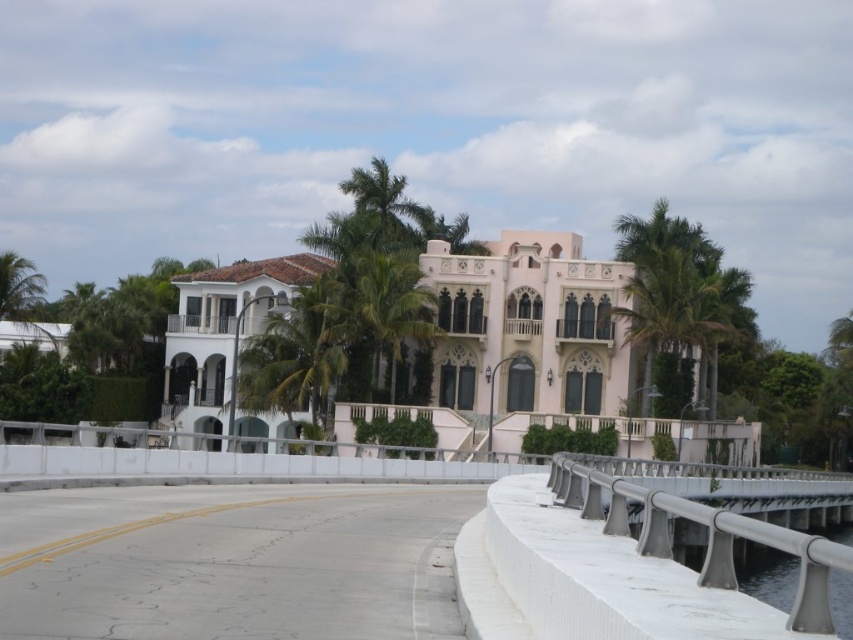
You are standing at the base of the Mediterranean building and want to walk towards the point marked at coordinates point (241, 284). However, there is an obstacle at point (339, 376). Will you encounter this obstacle before reaching your destination?

Yes, you will encounter the obstacle at point (339, 376) before reaching point (241, 284) because point (241, 284) is behind point (339, 376).

You are planning to take a photo of the pink stucco mansion at center and the green leafy palm tree at center from a distance. Considering their sizes, which object would appear more prominent in the photo?

The pink stucco mansion at center is larger in size than the green leafy palm tree at center, so it would appear more prominent in the photo.

You are a drone operator planning to fly a drone over the pink stucco mansion at center and the green leafy palm tree at center. Which object will the drone need to ascend higher to capture from above?

The drone will need to ascend higher to capture the pink stucco mansion at center because it is taller than the green leafy palm tree at center.